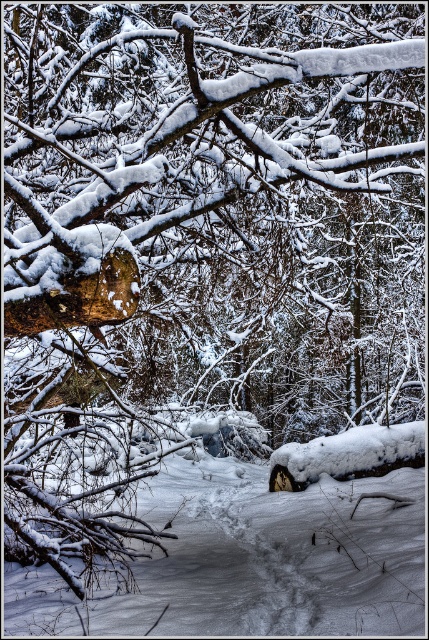
Question: Which point is closer to the camera?

Choices:
 (A) smooth brown log at upper left
 (B) white fluffy snow at center

Answer: (A)

Question: From the image, what is the correct spatial relationship of smooth brown log at upper left in relation to white fluffy snow at center?

Choices:
 (A) above
 (B) below

Answer: (A)

Question: Does smooth brown log at upper left appear on the left side of white fluffy snow at center?

Choices:
 (A) yes
 (B) no

Answer: (A)

Question: Is smooth brown log at upper left smaller than white fluffy snow at center?

Choices:
 (A) no
 (B) yes

Answer: (A)

Question: Which point is farther from the camera taking this photo?

Choices:
 (A) (268, 556)
 (B) (106, 12)

Answer: (B)